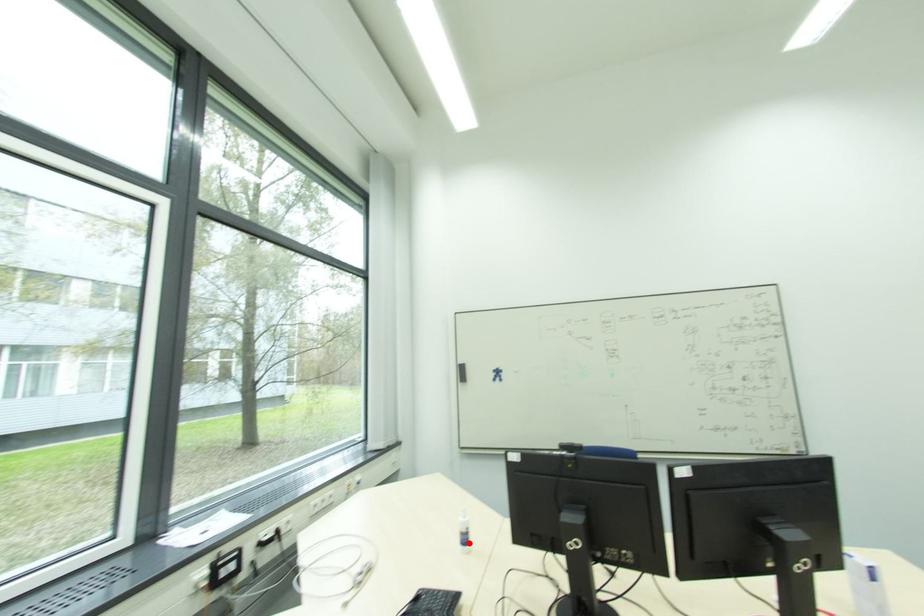
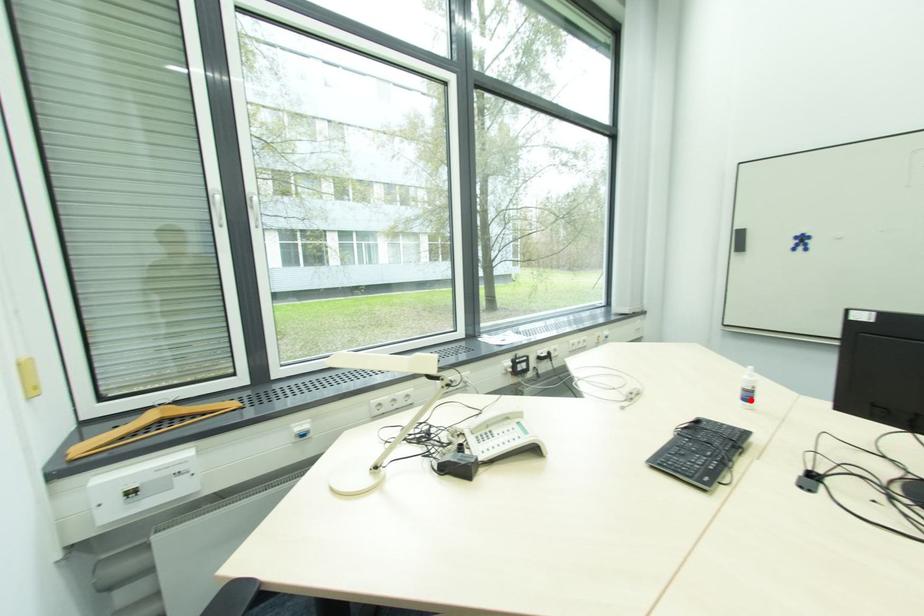
I am providing you with two images of the same scene from different viewpoints. A red point is marked on the first image and another point is marked on the second image. Does the point marked in image1 correspond to the same location as the one in image2?

Yes